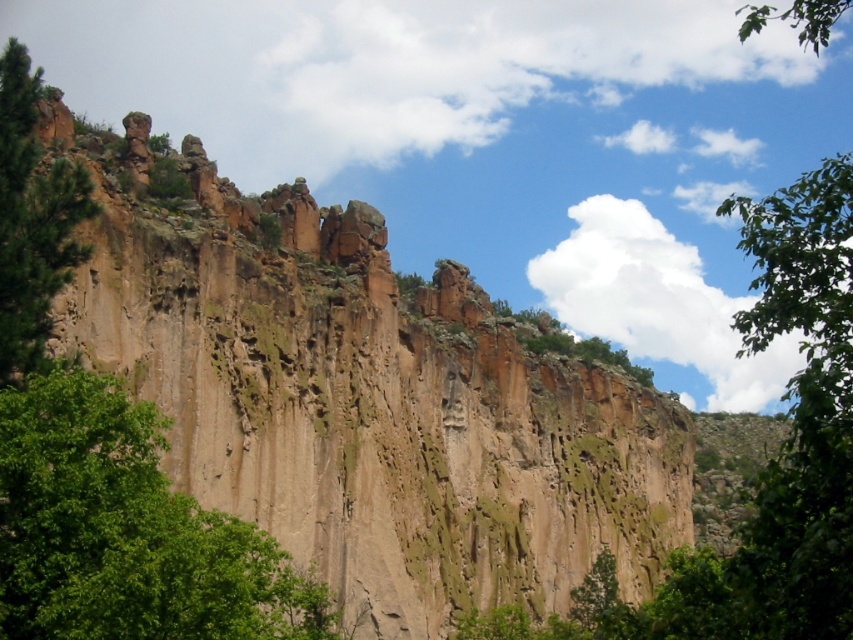
Is brown rough rock at center to the right of green leafy tree at center from the viewer's perspective?

Yes, brown rough rock at center is to the right of green leafy tree at center.

Between brown rough rock at center and green leafy tree at center, which one is positioned higher?

brown rough rock at center is above.

Is point (120, 161) less distant than point (170, 550)?

No.

Find the location of a particular element. This screenshot has width=853, height=640. brown rough rock at center is located at coordinates (363, 397).

Can you confirm if brown rough rock at center is wider than green rough bark tree at left?

Correct, the width of brown rough rock at center exceeds that of green rough bark tree at left.

Which is behind, point (415, 461) or point (7, 49)?

The point (415, 461) is more distant.

Does point (618, 548) come farther from viewer compared to point (10, 259)?

Yes, point (618, 548) is behind point (10, 259).

Locate an element on the screen. brown rough rock at center is located at coordinates (363, 397).

Can you confirm if green leafy tree at center is positioned to the left of green rough bark tree at left?

No, green leafy tree at center is not to the left of green rough bark tree at left.

Can you confirm if green leafy tree at center is positioned to the right of green rough bark tree at left?

Yes, green leafy tree at center is to the right of green rough bark tree at left.

Image resolution: width=853 pixels, height=640 pixels. In order to click on green leafy tree at center in this screenshot , I will do `click(125, 531)`.